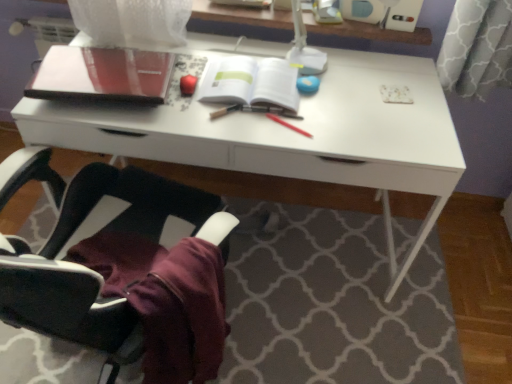
Where is `vacant space that is to the left of wooden pencil at center, the second stationery viewed from the right`? The height and width of the screenshot is (384, 512). vacant space that is to the left of wooden pencil at center, the second stationery viewed from the right is located at coordinates (180, 114).